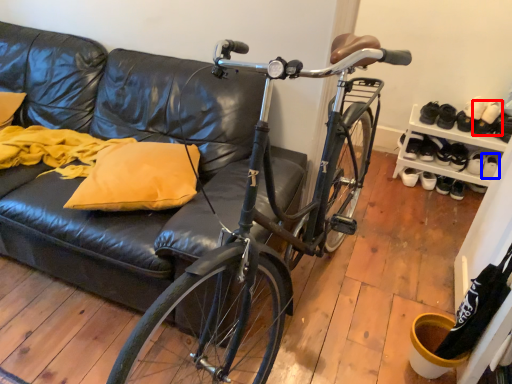
Question: Which object is further to the camera taking this photo, footwear (highlighted by a red box) or footwear (highlighted by a blue box)?

Choices:
 (A) footwear
 (B) footwear

Answer: (B)